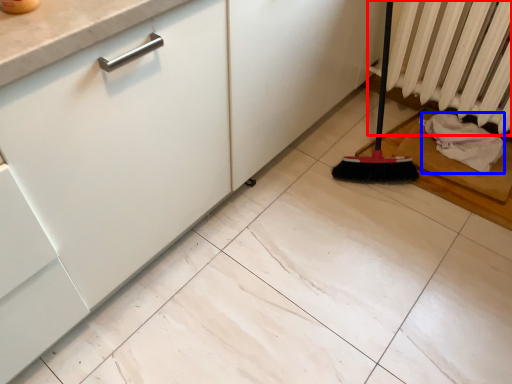
Question: Which of the following is the closest to the observer, radiator (highlighted by a red box) or material (highlighted by a blue box)?

Choices:
 (A) radiator
 (B) material

Answer: (A)